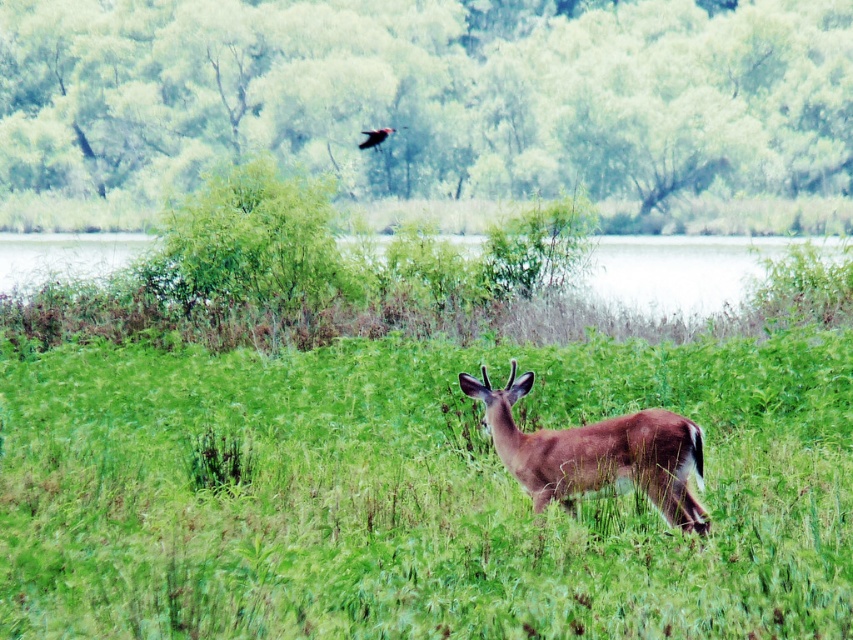
Which is more to the right, green grassy lake at center or brown matte/deer at center?

brown matte/deer at center is more to the right.

Find the location of a particular element. green grassy lake at center is located at coordinates (486, 307).

Locate an element on the screen. green grassy lake at center is located at coordinates (486, 307).

Between green grassy at center and shiny black bird at upper center, which one has more height?

shiny black bird at upper center

Does point (180, 577) come closer to viewer compared to point (372, 131)?

Yes, point (180, 577) is closer to viewer.

Does point (383, 625) come farther from viewer compared to point (383, 132)?

No, it is not.

The image size is (853, 640). In order to click on green grassy at center in this screenshot , I will do `click(416, 493)`.

Can you confirm if brown matte/deer at center is shorter than shiny black bird at upper center?

Correct, brown matte/deer at center is not as tall as shiny black bird at upper center.

Which is more to the right, brown matte/deer at center or shiny black bird at upper center?

From the viewer's perspective, brown matte/deer at center appears more on the right side.

Describe the element at coordinates (596, 452) in the screenshot. The height and width of the screenshot is (640, 853). I see `brown matte/deer at center` at that location.

Locate an element on the screen. brown matte/deer at center is located at coordinates pos(596,452).